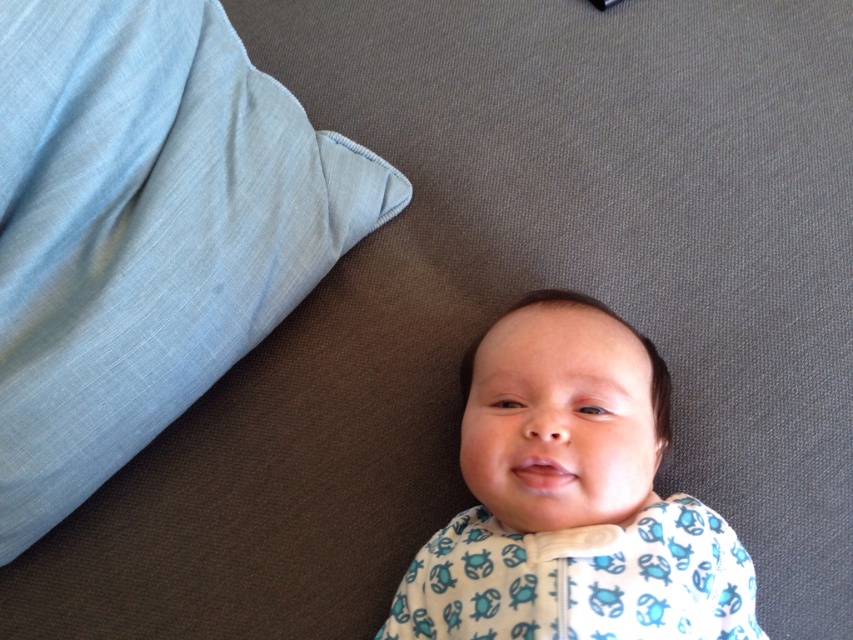
Question: Is light blue fabric at upper left smaller than white soft fabric baby at center?

Choices:
 (A) no
 (B) yes

Answer: (A)

Question: Is light blue fabric at upper left to the left of white soft fabric baby at center from the viewer's perspective?

Choices:
 (A) yes
 (B) no

Answer: (A)

Question: Can you confirm if light blue fabric at upper left is bigger than white soft fabric baby at center?

Choices:
 (A) yes
 (B) no

Answer: (A)

Question: Among these points, which one is farthest from the camera?

Choices:
 (A) (267, 252)
 (B) (498, 544)

Answer: (A)

Question: Which point is farther to the camera?

Choices:
 (A) white soft fabric baby at center
 (B) light blue fabric at upper left

Answer: (B)